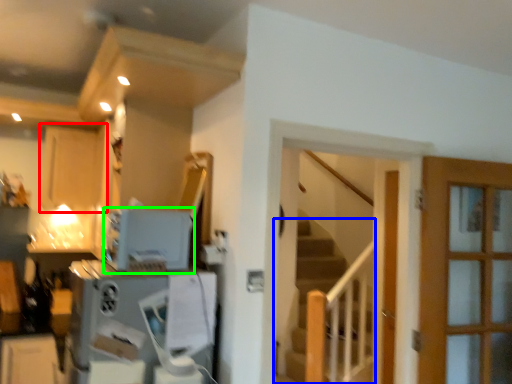
Question: Considering the real-world distances, which object is closest to cabinetry (highlighted by a red box)? stairs (highlighted by a blue box) or appliance (highlighted by a green box).

Choices:
 (A) stairs
 (B) appliance

Answer: (B)